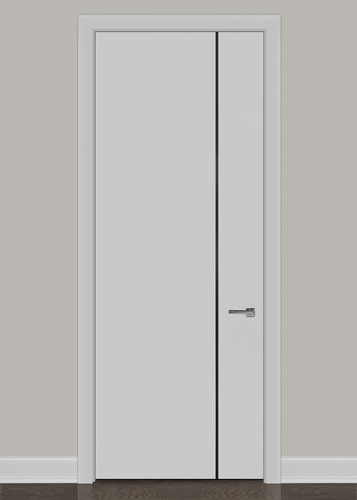
This screenshot has height=500, width=357. In order to click on top doorframe in this screenshot , I will do `click(184, 24)`.